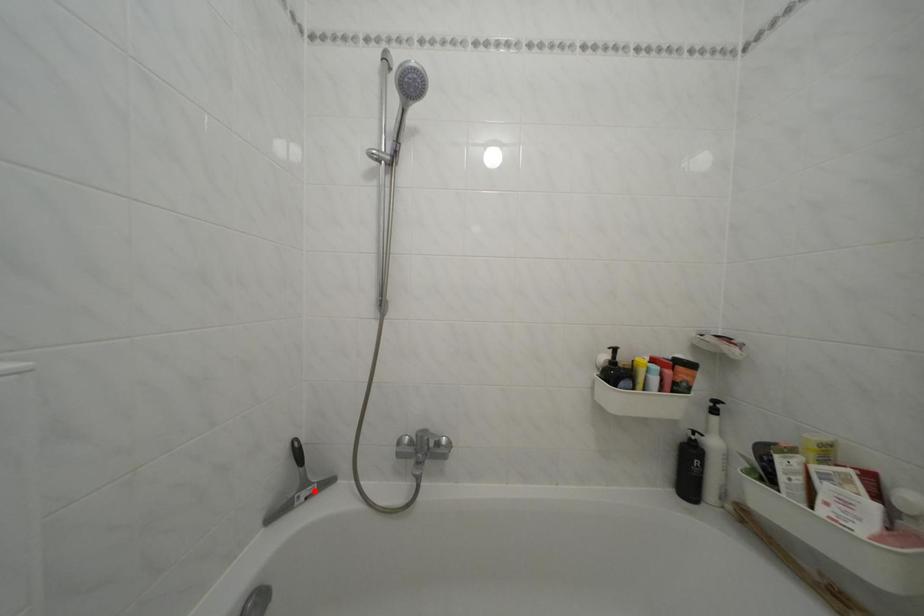
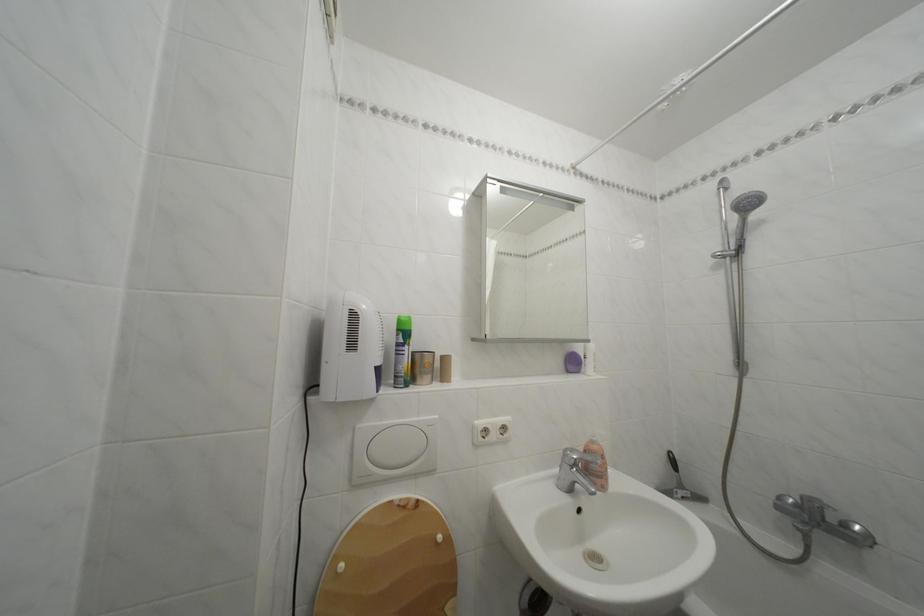
Locate, in the second image, the point that corresponds to the highlighted location in the first image.

(689, 492)